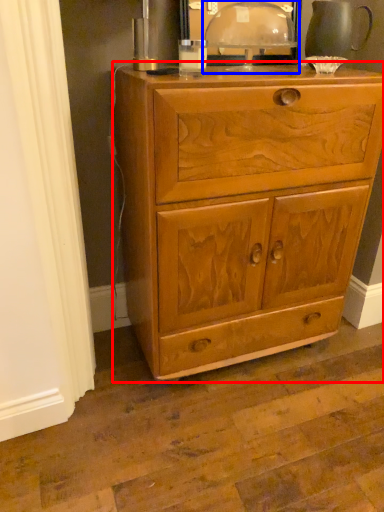
Question: Which point is further to the camera, chest of drawers (highlighted by a red box) or table lamp (highlighted by a blue box)?

Choices:
 (A) chest of drawers
 (B) table lamp

Answer: (B)